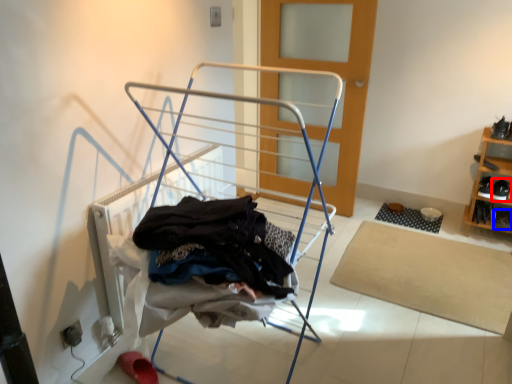
Question: Which point is closer to the camera, footwear (highlighted by a red box) or shoe (highlighted by a blue box)?

Choices:
 (A) footwear
 (B) shoe

Answer: (A)